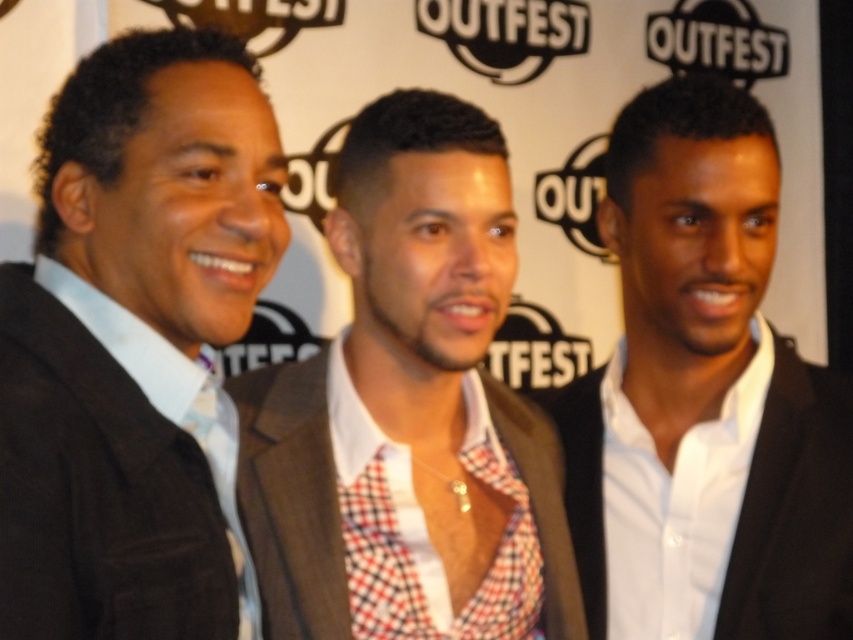
Question: Considering the real-world distances, which object is farthest from the checkered fabric shirt at center?

Choices:
 (A) white glossy suit at center
 (B) matte black suit at left

Answer: (A)

Question: Does matte black suit at left have a smaller size compared to checkered fabric shirt at center?

Choices:
 (A) no
 (B) yes

Answer: (B)

Question: Does checkered fabric shirt at center appear on the right side of white glossy suit at center?

Choices:
 (A) no
 (B) yes

Answer: (A)

Question: From the image, what is the correct spatial relationship of matte black suit at left in relation to checkered fabric shirt at center?

Choices:
 (A) above
 (B) below

Answer: (A)

Question: Among these objects, which one is nearest to the camera?

Choices:
 (A) matte black suit at left
 (B) white glossy suit at center

Answer: (A)

Question: Considering the real-world distances, which object is farthest from the matte black suit at left?

Choices:
 (A) white glossy suit at center
 (B) checkered fabric shirt at center

Answer: (A)